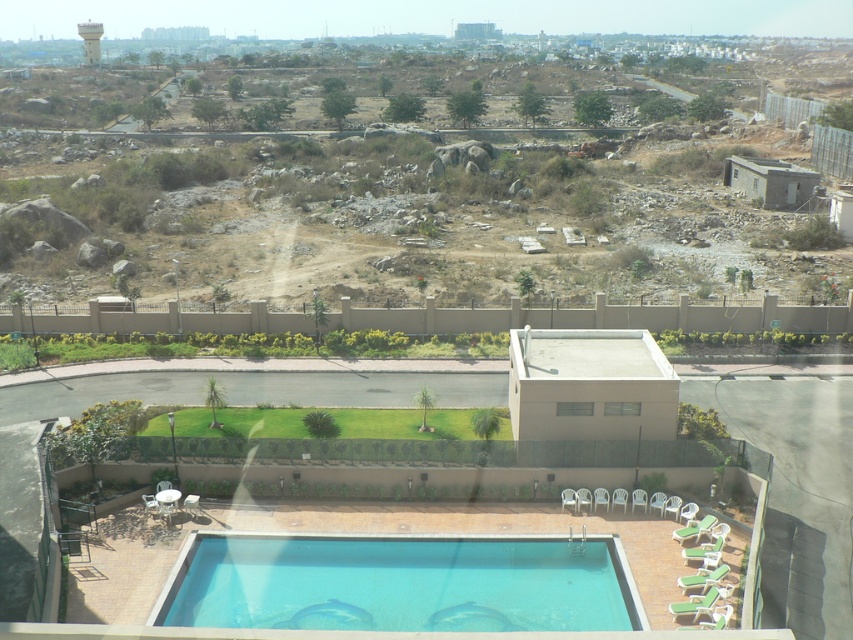
You are a drone operator trying to capture a photo of the brown rocky terrain at upper center and the white concrete water tower at upper left. From the perspective of someone looking at the scene, which object is located to the right of the other?

The brown rocky terrain at upper center is positioned on the right side of white concrete water tower at upper left.

Based on the photo, you are standing at the poolside and looking towards the upper part of the image. Which object is closer to you between the brown rocky terrain at upper center and the white concrete water tower at upper left?

The brown rocky terrain at upper center is closer to you because it is in front of the white concrete water tower at upper left.